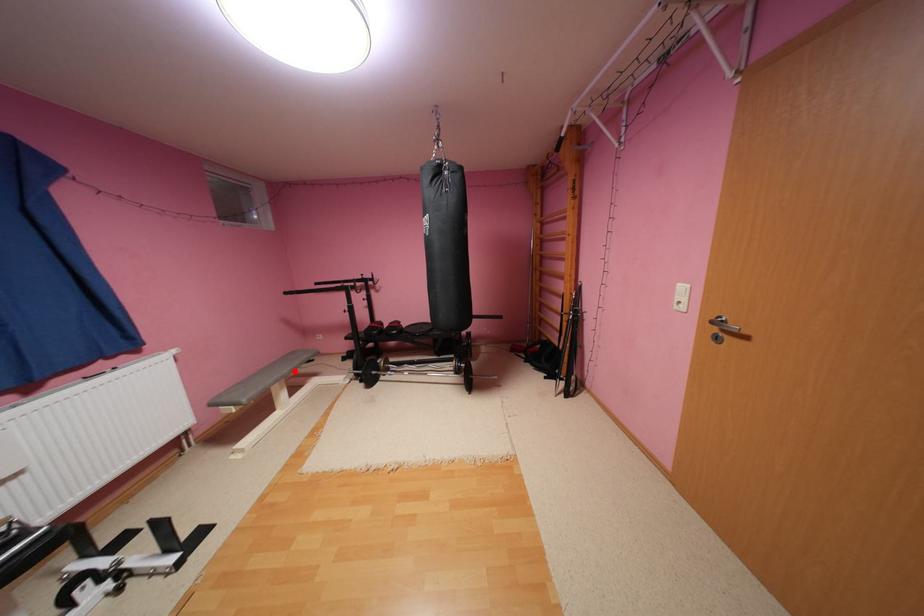
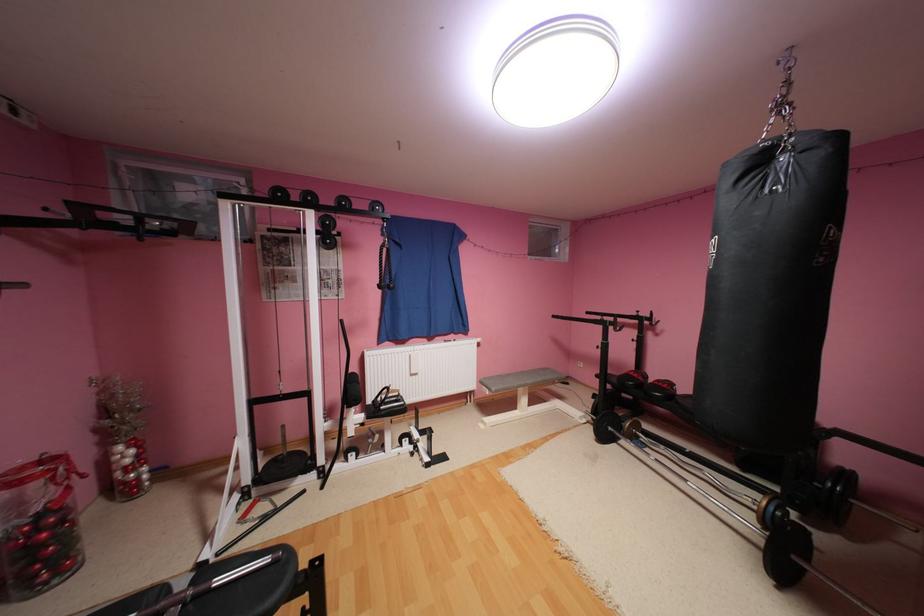
Locate, in the second image, the point that corresponds to the highlighted location in the first image.

(538, 382)